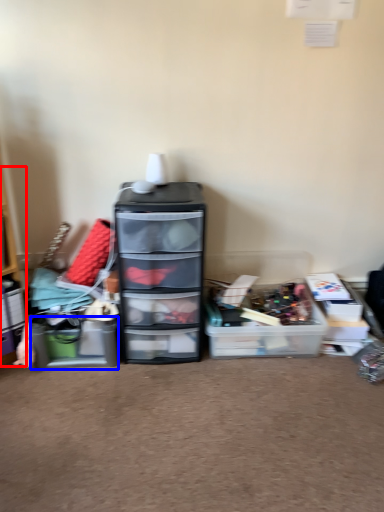
Question: Which object is closer to the camera taking this photo, shelf (highlighted by a red box) or storage box (highlighted by a blue box)?

Choices:
 (A) shelf
 (B) storage box

Answer: (A)